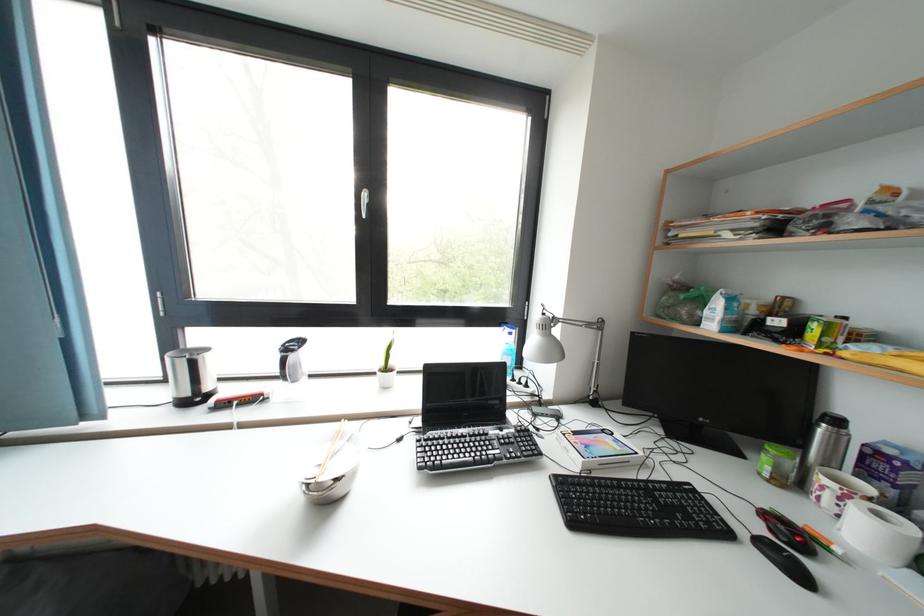
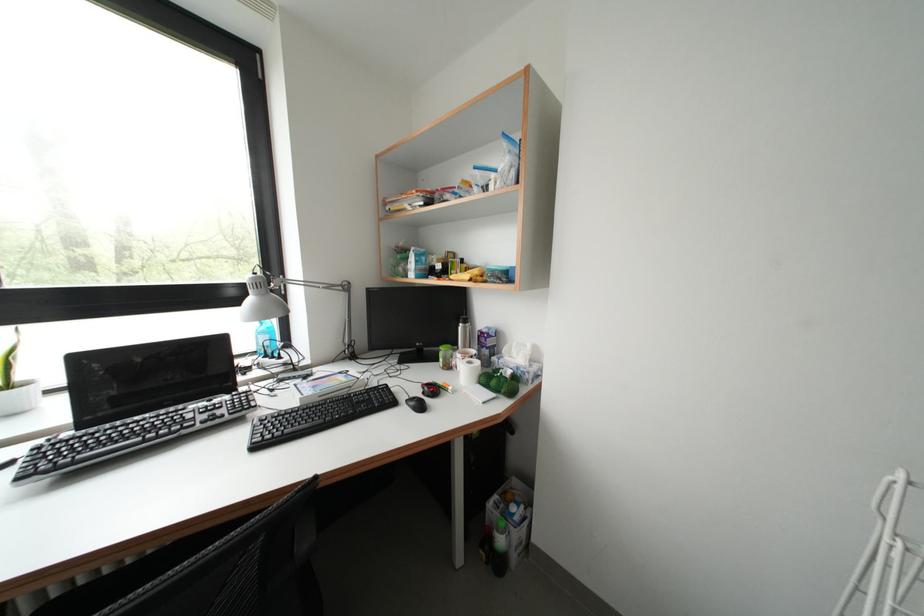
Where in the second image is the point corresponding to point 551,318 from the first image?

(261, 278)